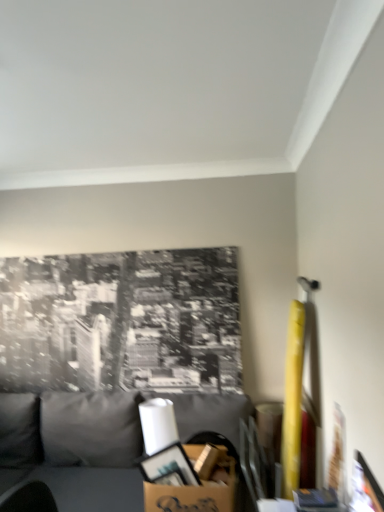
Question: From the image's perspective, is gray fabric couch at lower left over cardboard box at lower center?

Choices:
 (A) yes
 (B) no

Answer: (B)

Question: Considering the relative sizes of gray fabric couch at lower left and cardboard box at lower center in the image provided, is gray fabric couch at lower left taller than cardboard box at lower center?

Choices:
 (A) yes
 (B) no

Answer: (A)

Question: Does gray fabric couch at lower left lie in front of cardboard box at lower center?

Choices:
 (A) no
 (B) yes

Answer: (B)

Question: Is gray fabric couch at lower left shorter than cardboard box at lower center?

Choices:
 (A) yes
 (B) no

Answer: (B)

Question: Can you confirm if gray fabric couch at lower left is positioned to the left of cardboard box at lower center?

Choices:
 (A) yes
 (B) no

Answer: (A)

Question: Can you confirm if gray fabric couch at lower left is positioned to the right of cardboard box at lower center?

Choices:
 (A) no
 (B) yes

Answer: (A)

Question: Is cardboard box at lower center aimed at gray fabric couch at lower left?

Choices:
 (A) yes
 (B) no

Answer: (A)

Question: Is the depth of cardboard box at lower center greater than that of gray fabric couch at lower left?

Choices:
 (A) no
 (B) yes

Answer: (B)

Question: Considering the relative sizes of cardboard box at lower center and gray fabric couch at lower left in the image provided, is cardboard box at lower center smaller than gray fabric couch at lower left?

Choices:
 (A) no
 (B) yes

Answer: (B)

Question: Considering the relative sizes of cardboard box at lower center and gray fabric couch at lower left in the image provided, is cardboard box at lower center bigger than gray fabric couch at lower left?

Choices:
 (A) yes
 (B) no

Answer: (B)

Question: From a real-world perspective, is cardboard box at lower center positioned under gray fabric couch at lower left based on gravity?

Choices:
 (A) yes
 (B) no

Answer: (B)

Question: Is cardboard box at lower center in contact with gray fabric couch at lower left?

Choices:
 (A) yes
 (B) no

Answer: (B)

Question: Does point (115, 435) appear closer or farther from the camera than point (177, 498)?

Choices:
 (A) closer
 (B) farther

Answer: (B)